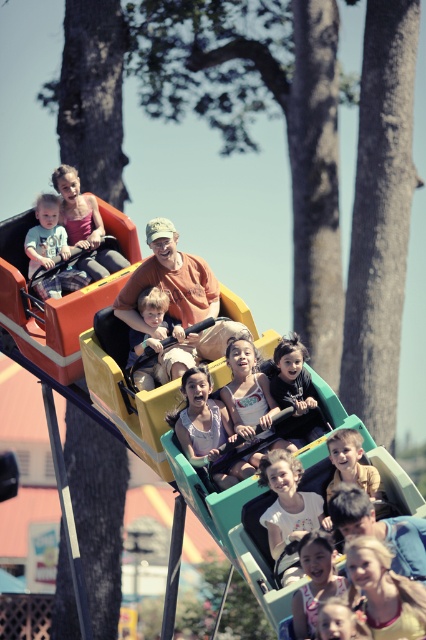
Question: Which point is farther to the camera?

Choices:
 (A) matte blue shirt at center
 (B) light brown hair at lower center
 (C) matte yellow slide at lower center

Answer: (A)

Question: Can you confirm if light brown fabric baby carriage at center is positioned to the left of matte blue shirt at center?

Choices:
 (A) no
 (B) yes

Answer: (A)

Question: Which of the following is the farthest from the observer?

Choices:
 (A) light brown hair at lower center
 (B) matte blue shirt at center

Answer: (B)

Question: Can you confirm if matte blue shirt at center is wider than light brown hair at lower center?

Choices:
 (A) no
 (B) yes

Answer: (B)

Question: Which is farther from the light brown hair at lower center?

Choices:
 (A) matte blue shirt at center
 (B) matte yellow slide at lower center
 (C) light brown fabric baby carriage at center

Answer: (A)

Question: Is light brown fabric baby carriage at center further to camera compared to matte blue shirt at center?

Choices:
 (A) no
 (B) yes

Answer: (A)